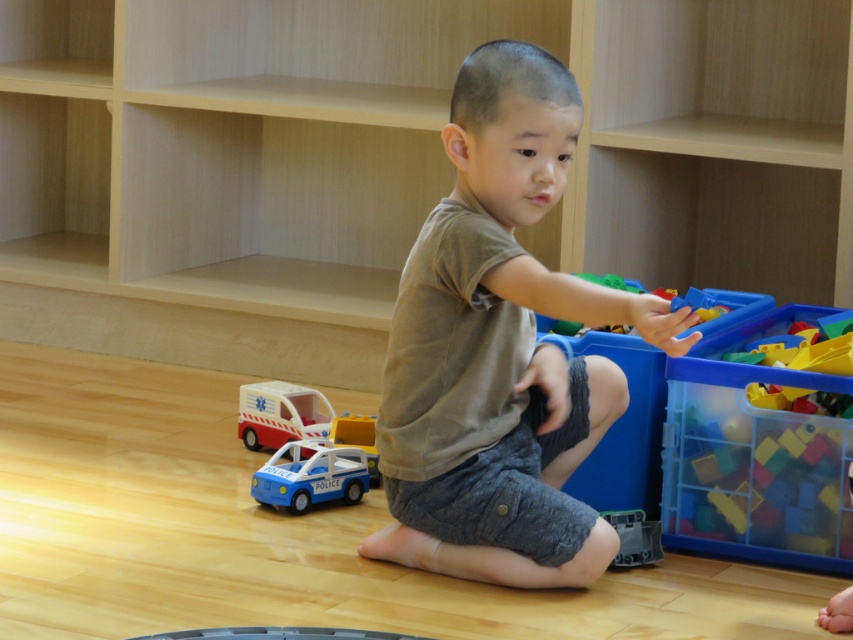
Is translucent plastic blocks at right behind blue plastic police car at lower left?

No.

Is translucent plastic blocks at right thinner than blue plastic police car at lower left?

In fact, translucent plastic blocks at right might be wider than blue plastic police car at lower left.

Who is more forward, (822, 440) or (340, 484)?

Point (822, 440) is more forward.

The image size is (853, 640). I want to click on translucent plastic blocks at right, so click(753, 458).

Who is more forward, (489, 301) or (273, 484)?

Positioned in front is point (489, 301).

Does brown cotton shirt at center have a greater width compared to blue plastic police car at lower left?

Yes.

Identify the location of brown cotton shirt at center. The image size is (853, 640). (500, 349).

Is brown cotton shirt at center to the right of translucent plastic blocks at right from the viewer's perspective?

No, brown cotton shirt at center is not to the right of translucent plastic blocks at right.

Is brown cotton shirt at center positioned behind translucent plastic blocks at right?

No, brown cotton shirt at center is in front of translucent plastic blocks at right.

Is point (462, 531) positioned in front of point (809, 481)?

Yes.

You are a GUI agent. You are given a task and a screenshot of the screen. Output one action in this format:
    pyautogui.click(x=<x>, y=<y>)
    Task: Click on the brown cotton shirt at center
    The width and height of the screenshot is (853, 640).
    Given the screenshot: What is the action you would take?
    (500, 349)